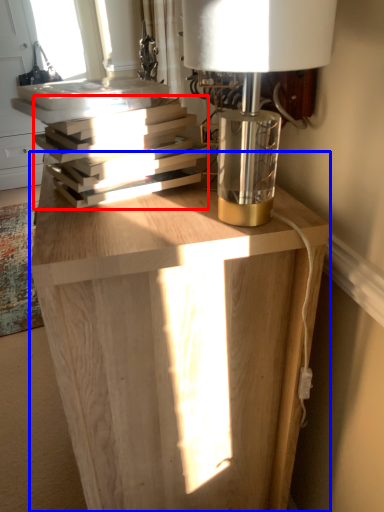
Question: Which object appears closest to the camera in this image, book (highlighted by a red box) or table (highlighted by a blue box)?

Choices:
 (A) book
 (B) table

Answer: (B)